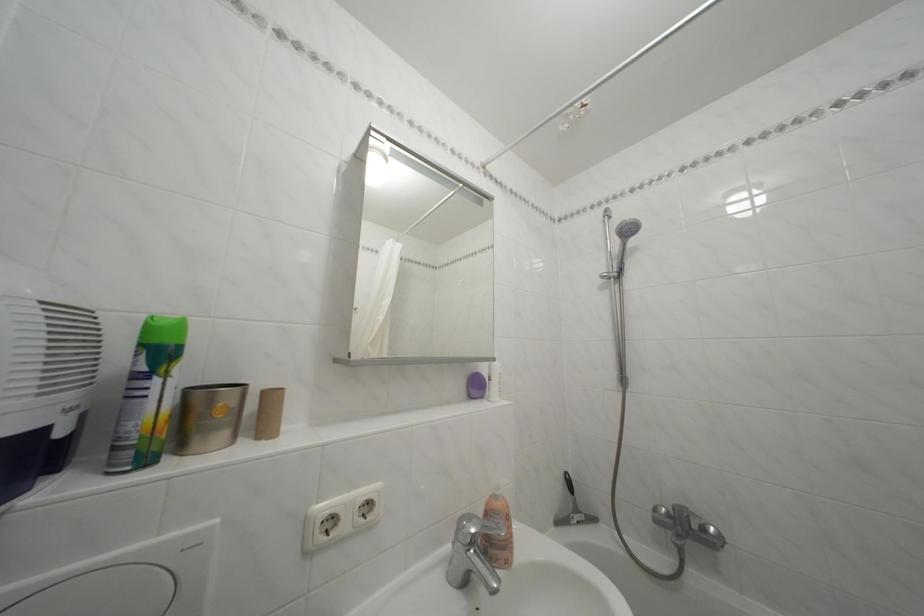
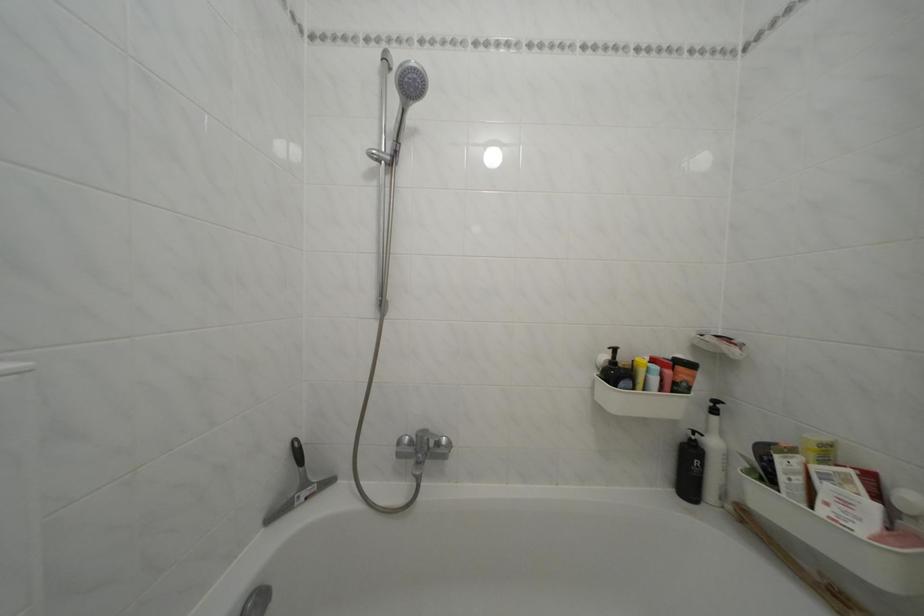
Question: Based on the continuous images, in which direction is the camera rotating? Reply with the corresponding letter.

Choices:
 (A) Left
 (B) Right
 (C) Up
 (D) Down

Answer: (B)